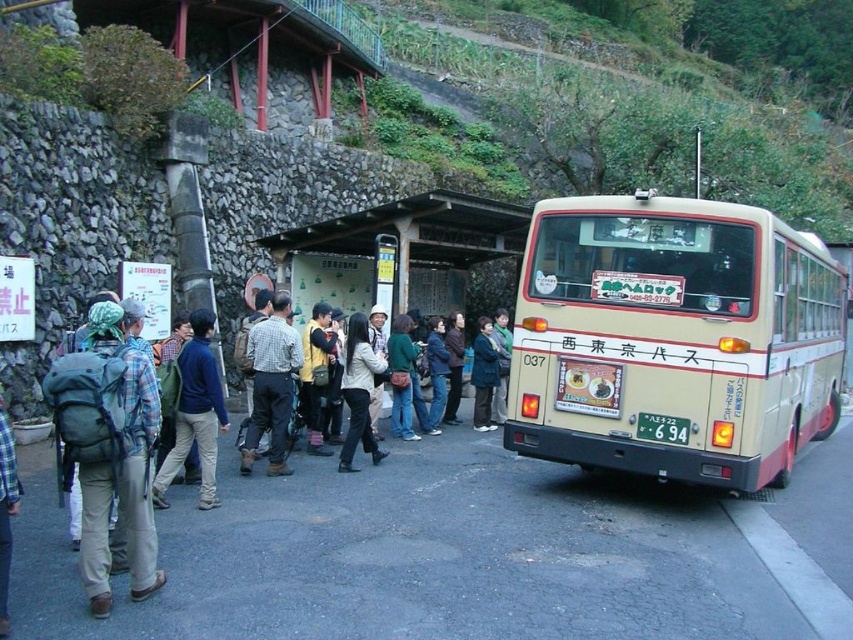
Question: Which of the following is the closest to the observer?

Choices:
 (A) pyautogui.click(x=666, y=435)
 (B) pyautogui.click(x=485, y=342)

Answer: (A)

Question: Is blue sweater at center thinner than white matte jacket at center?

Choices:
 (A) no
 (B) yes

Answer: (A)

Question: Is checkered fabric shirt at center positioned behind dark blue fabric jacket at center?

Choices:
 (A) no
 (B) yes

Answer: (A)

Question: Estimate the real-world distances between objects in this image. Which object is closer to the white plastic license plate at center?

Choices:
 (A) white matte jacket at center
 (B) blue sweater at center
 (C) wooden bus stop at center
 (D) dark blue fabric jacket at center

Answer: (A)

Question: Does wooden bus stop at center have a smaller size compared to white matte jacket at center?

Choices:
 (A) no
 (B) yes

Answer: (B)

Question: Estimate the real-world distances between objects in this image. Which object is farther from the checkered fabric shirt at center?

Choices:
 (A) dark blue fabric jacket at center
 (B) white matte jacket at center

Answer: (A)